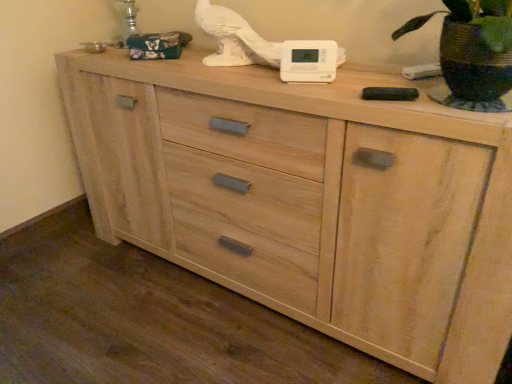
Question: Should I look upward or downward to see white plastic thermostat at center?

Choices:
 (A) up
 (B) down

Answer: (A)